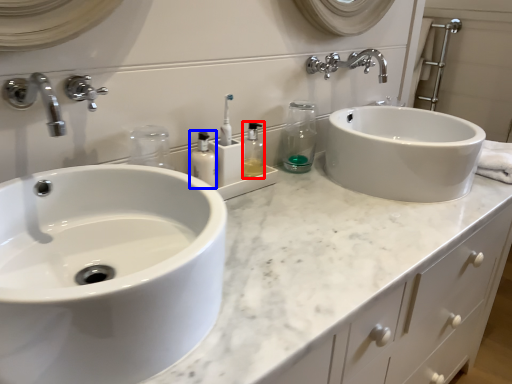
Question: Which object is closer to the camera taking this photo, toiletry (highlighted by a red box) or mouthwash (highlighted by a blue box)?

Choices:
 (A) toiletry
 (B) mouthwash

Answer: (B)